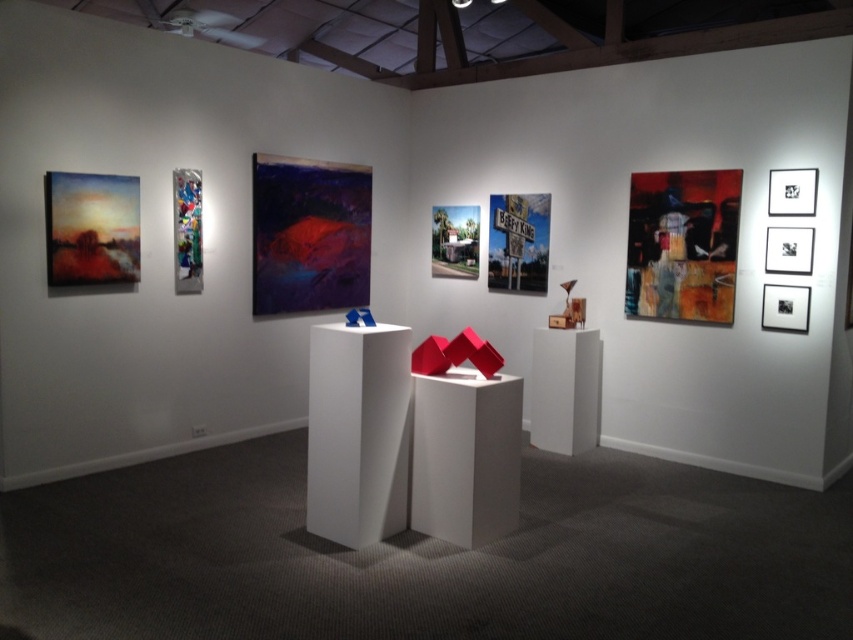
You are standing in the art gallery and want to take a photo of the point at coordinates (518, 228). If your camera has a focal length of 50mm and you need to be exactly 6 meters away to frame it properly, is your current distance sufficient?

The point at coordinates (518, 228) is 6.09 meters away from you. Since 6.09 meters is slightly more than 6 meters, your current distance is just enough to frame it properly with the camera settings.

You are an art curator planning to hang a new artwork between the metallic street sign at center and the metallic silver sign at center. Based on their sizes, which one should the new artwork be placed closer to?

The new artwork should be placed closer to the metallic silver sign at center because the metallic street sign at center is taller than the metallic silver sign at center, so the shorter metallic silver sign would allow more balanced spacing.

You are standing in the art gallery and want to take a photo of the matte oil painting at left. Where should you position yourself to capture it in the frame?

To capture the matte oil painting at left in your photo, position yourself so that the camera is aimed at the coordinates specified by the point 0.358 on the x axis and 0.108 on the y axis, which corresponds to its 2D location in the image.